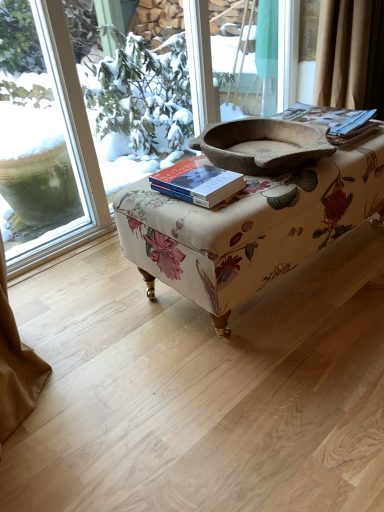
Question: From the image's perspective, is matte brown book at upper right, the 2th paperback book ordered from the bottom, above or below floral fabric ottoman at center?

Choices:
 (A) above
 (B) below

Answer: (A)

Question: In the image, is matte brown book at upper right, acting as the 1th paperback book starting from the back, positioned in front of or behind floral fabric ottoman at center?

Choices:
 (A) front
 (B) behind

Answer: (B)

Question: Estimate the real-world distances between objects in this image. Which object is closer to the transparent glass window at upper left?

Choices:
 (A) floral fabric ottoman at center
 (B) rustic wooden bowl at center
 (C) matte brown book at upper right, placed as the first paperback book when sorted from top to bottom
 (D) hardcover book at center, the second paperback book positioned from the right

Answer: (C)

Question: Considering the real-world distances, which object is closest to the matte brown book at upper right, which is the 2th paperback book in front-to-back order?

Choices:
 (A) rustic wooden bowl at center
 (B) transparent glass window at upper left
 (C) floral fabric ottoman at center
 (D) hardcover book at center, the second paperback book positioned from the right

Answer: (A)